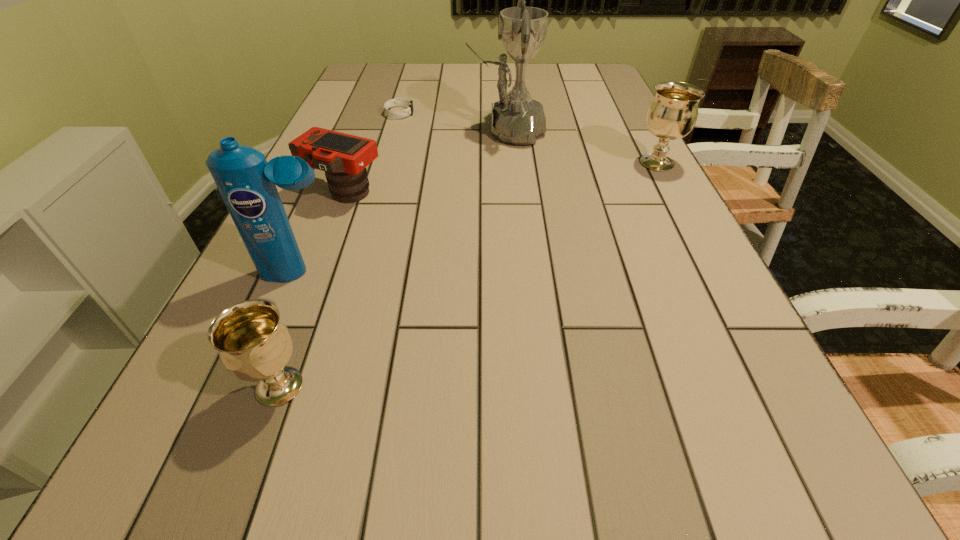
If the aim is uniform spacing by inserting an additional chalice among them, please point to a vacant space for this new chalice. Please provide its 2D coordinates. Your answer should be formatted as a tuple, i.e. [(x, y)], where the tuple contains the x and y coordinates of a point satisfying the conditions above.

[(516, 246)]